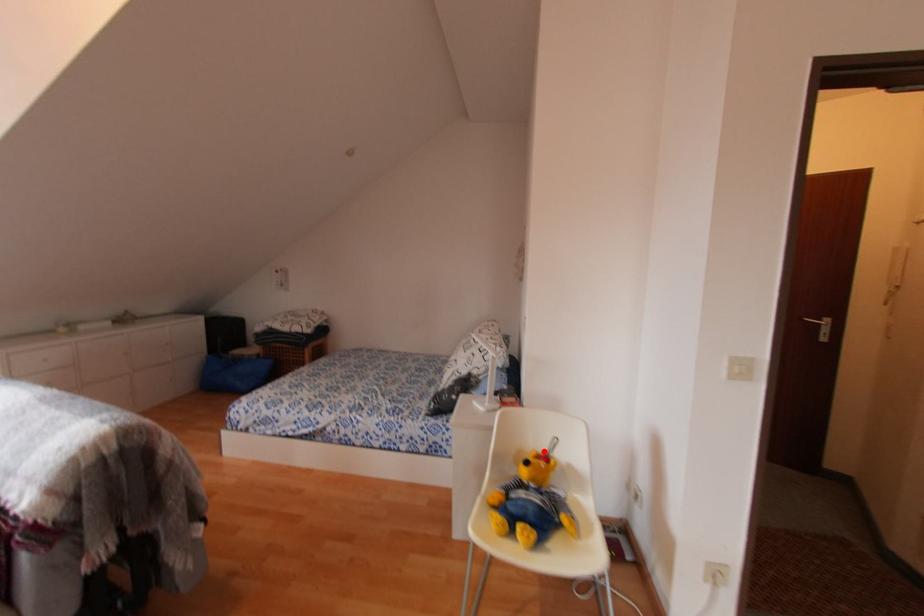
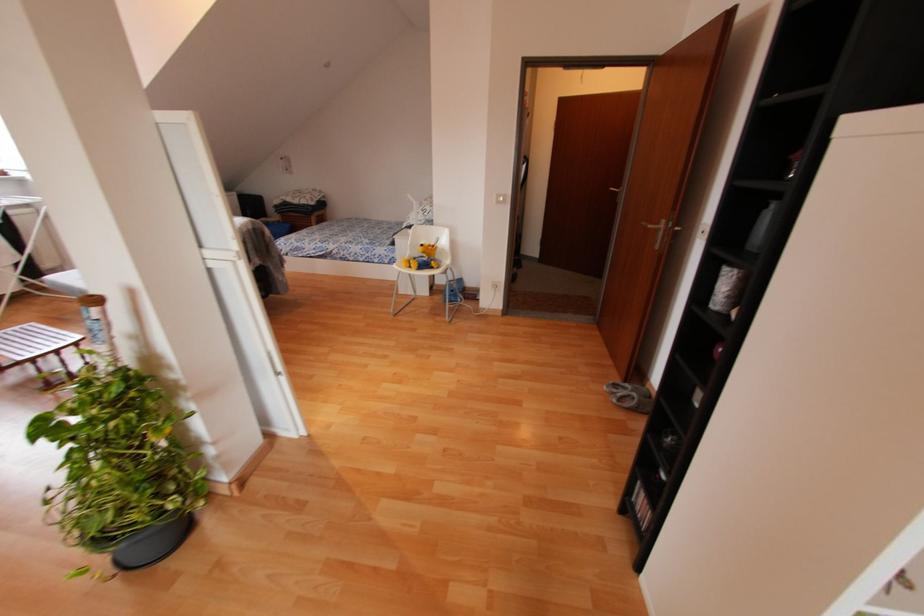
Question: A red point is marked in image1. In image2, is the corresponding 3D point closer to the camera or farther? Reply with the corresponding letter.

Choices:
 (A) The corresponding 3D point is closer.
 (B) The corresponding 3D point is farther.

Answer: (A)